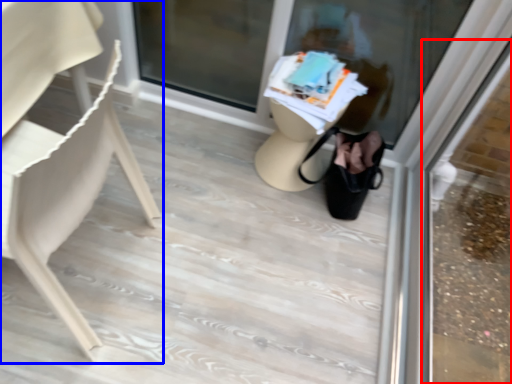
Question: Which of the following is the farthest to the observer, shop window (highlighted by a red box) or chair (highlighted by a blue box)?

Choices:
 (A) shop window
 (B) chair

Answer: (B)